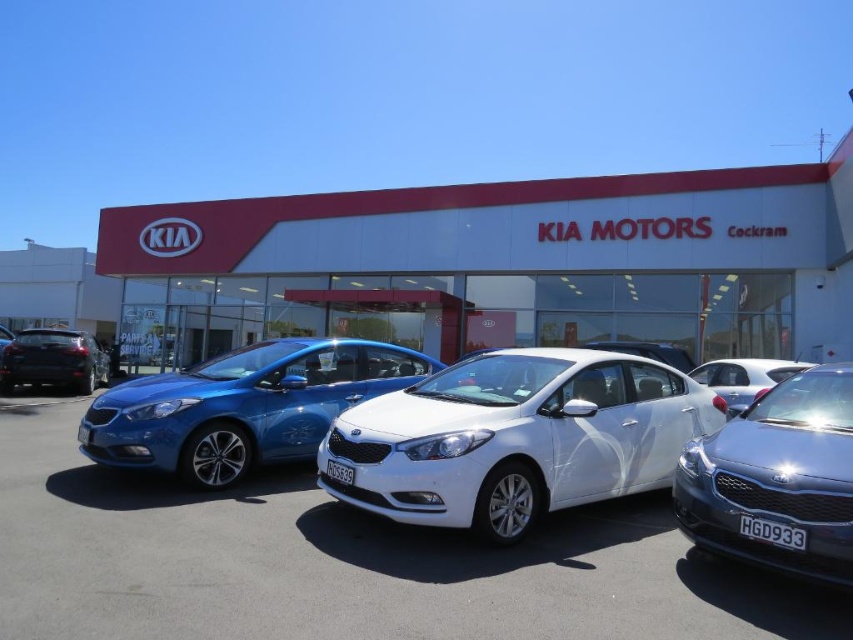
Question: Which of the following is the farthest from the observer?

Choices:
 (A) white glossy car at center
 (B) matte black sedan at left
 (C) satin silver sedan at center
 (D) satin silver car at center

Answer: (B)

Question: Can you confirm if white glossy car at center is positioned above satin silver sedan at center?

Choices:
 (A) no
 (B) yes

Answer: (B)

Question: Is white glossy car at center behind white glossy sedan at center?

Choices:
 (A) yes
 (B) no

Answer: (A)

Question: Based on their relative distances, which object is nearer to the white glossy car at center?

Choices:
 (A) satin silver car at center
 (B) satin silver sedan at center

Answer: (A)

Question: Can you confirm if white glossy sedan at center is positioned above satin silver car at center?

Choices:
 (A) no
 (B) yes

Answer: (A)

Question: Considering the real-world distances, which object is farthest from the satin silver sedan at center?

Choices:
 (A) matte white sedan at center
 (B) white glossy car at center
 (C) matte black sedan at left
 (D) white glossy sedan at center

Answer: (C)